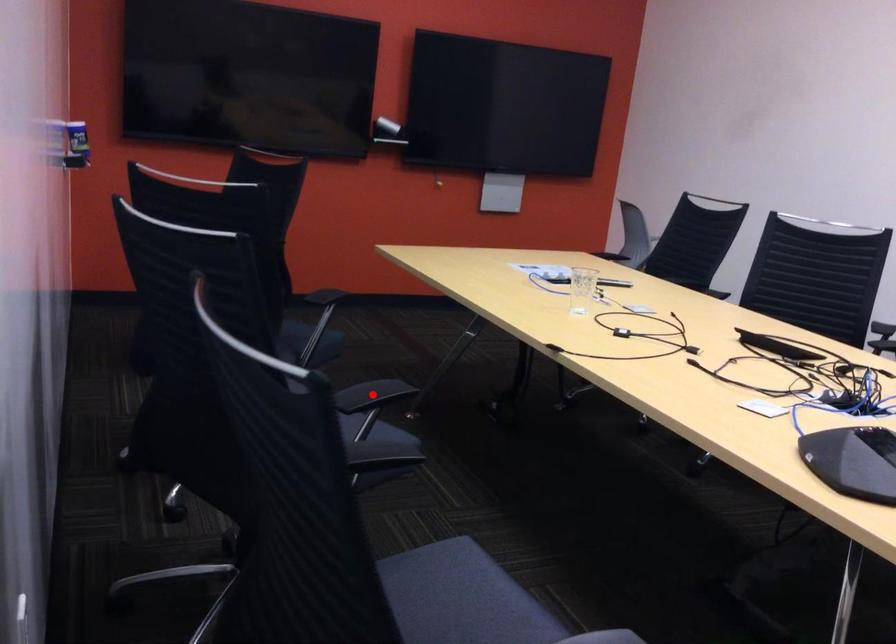
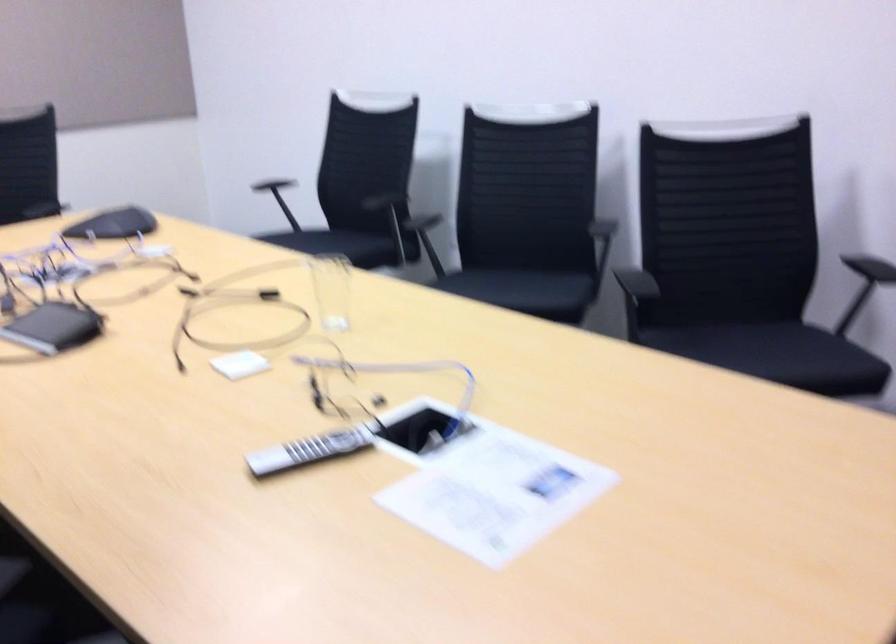
Question: I am providing you with two images of the same scene from different viewpoints. A red point is marked on the first image. Is the red point's position out of view in image 2?

Choices:
 (A) Yes
 (B) No

Answer: (A)